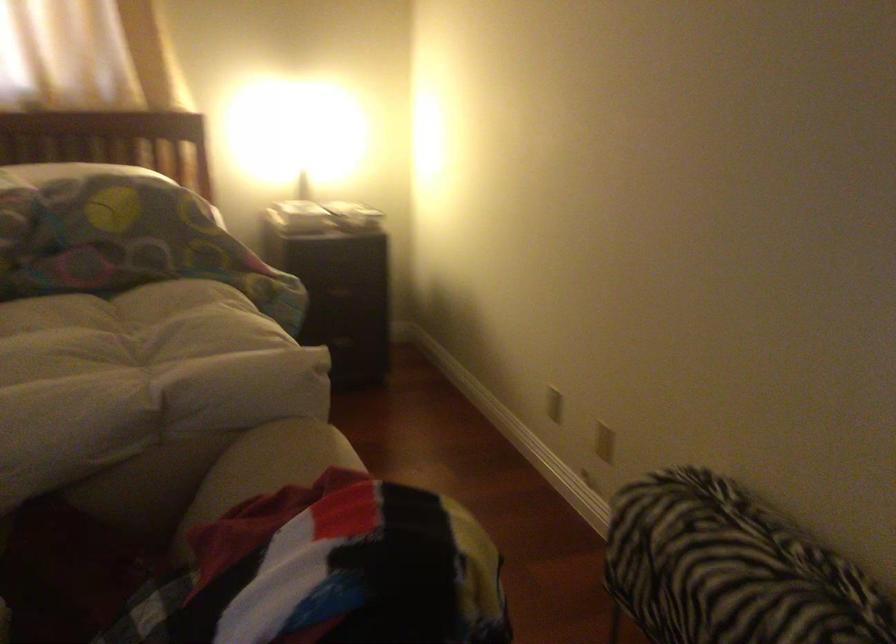
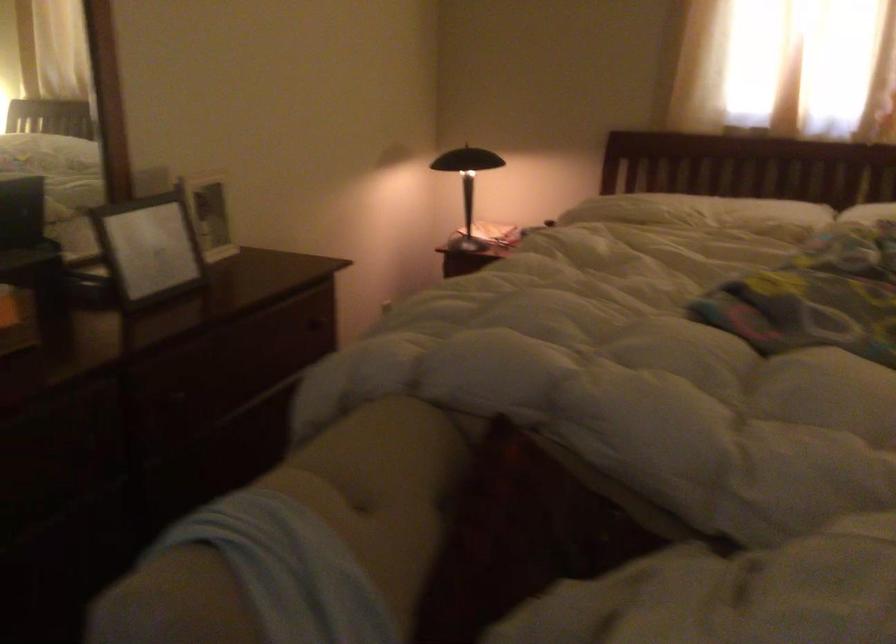
Question: The camera is either moving clockwise (left) or counter-clockwise (right) around the object. The first image is from the beginning of the video and the second image is from the end. Is the camera moving left or right when shooting the video?

Choices:
 (A) Left
 (B) Right

Answer: (B)